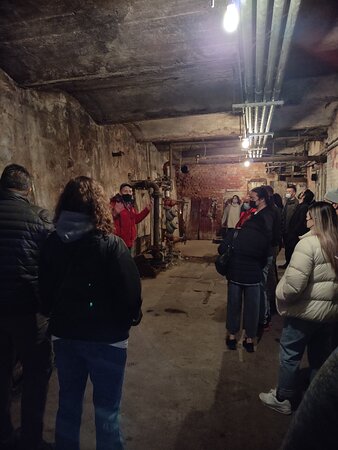
Find the location of `vent tubing`. vent tubing is located at coordinates (250, 121), (256, 119), (263, 118), (269, 120), (221, 160), (226, 143), (332, 146), (155, 207), (164, 168).